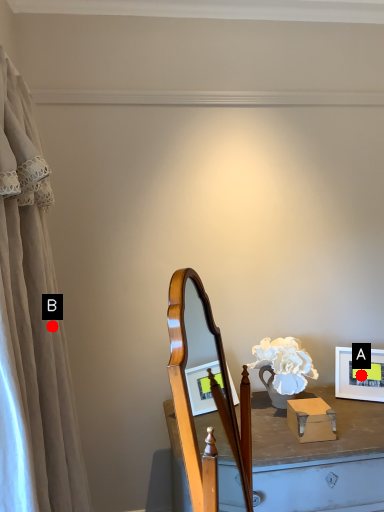
Question: Two points are circled on the image, labeled by A and B beside each circle. Which of the following is the farthest from the observer?

Choices:
 (A) A is further
 (B) B is further

Answer: (A)